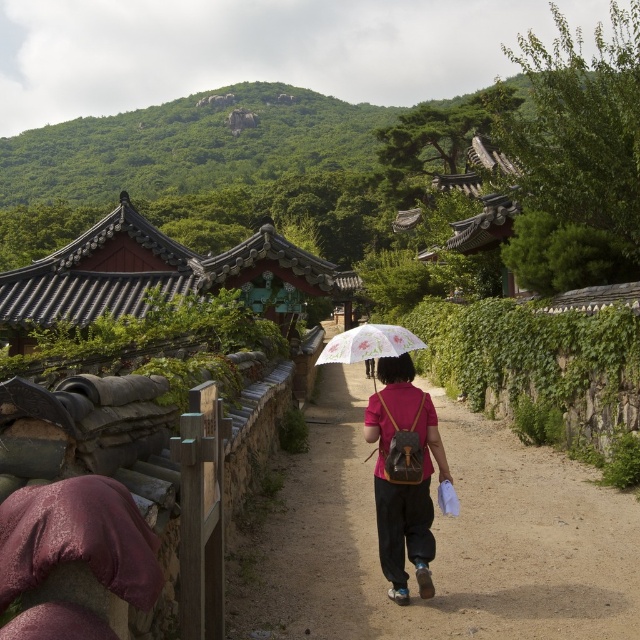
You are planning to walk along the brown dirt path at center while wearing the matte pink shirt at center. Considering the path width, will the shirt be visible from both sides of the path?

The brown dirt path at center is wider than the matte pink shirt at center, so yes, the matte pink shirt at center will be visible from both sides of the path.